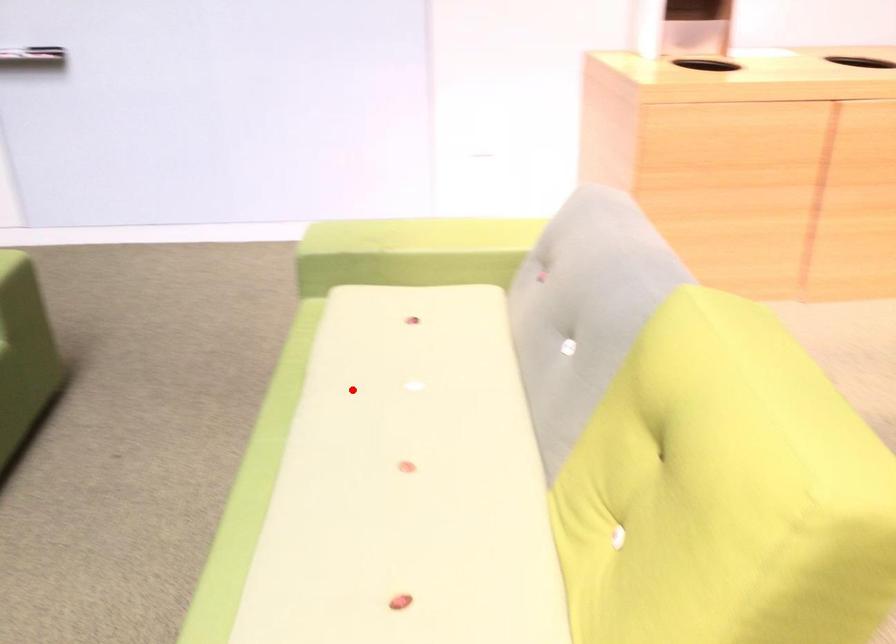
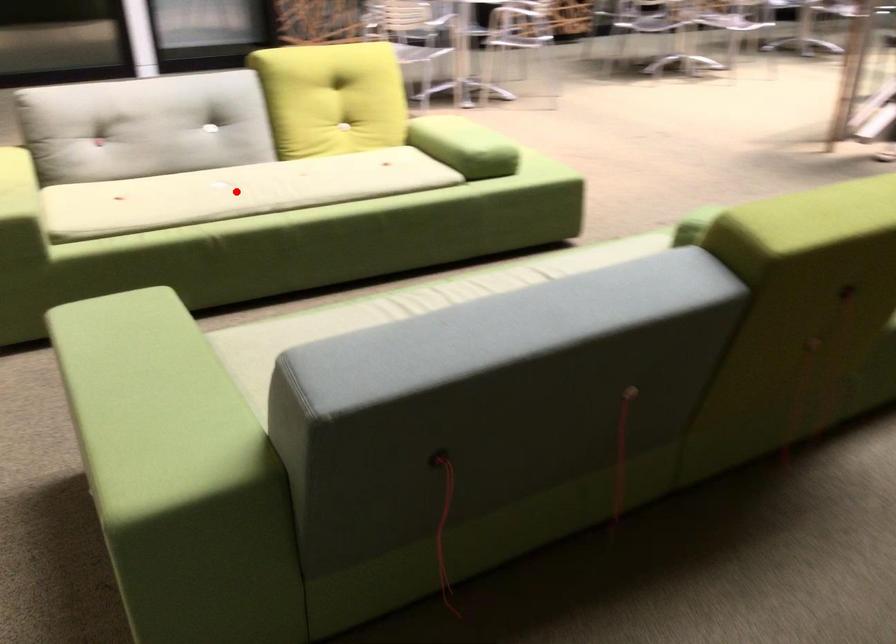
I am providing you with two images of the same scene from different viewpoints. A red point is marked on the first image and another point is marked on the second image. Does the point marked in image1 correspond to the same location as the one in image2?

Yes